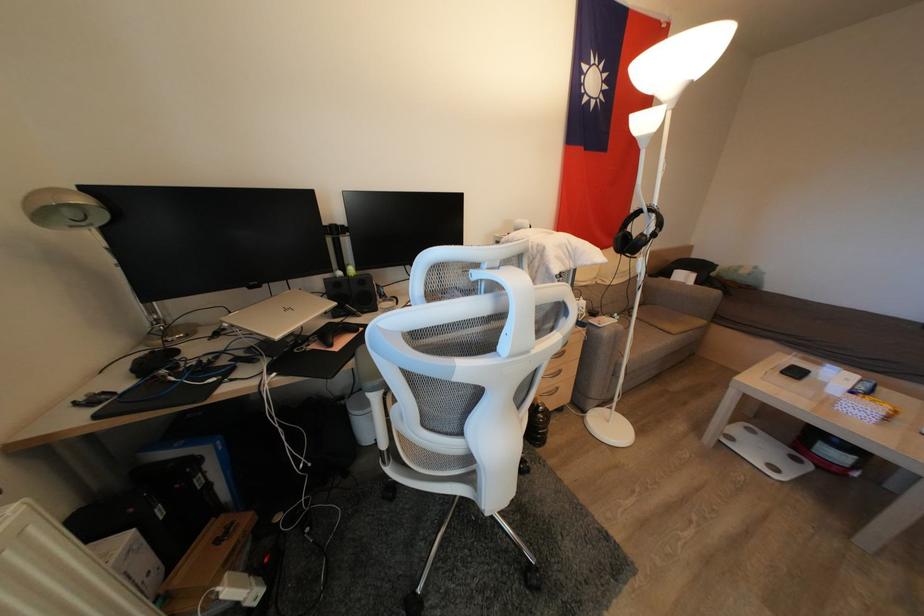
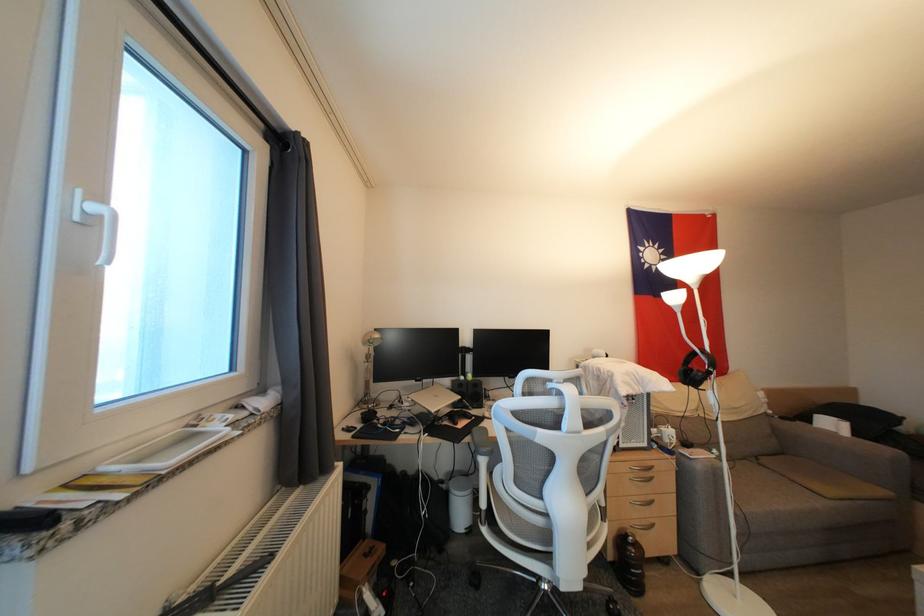
Find the pixel in the second image that matches (356,369) in the first image.

(472, 443)